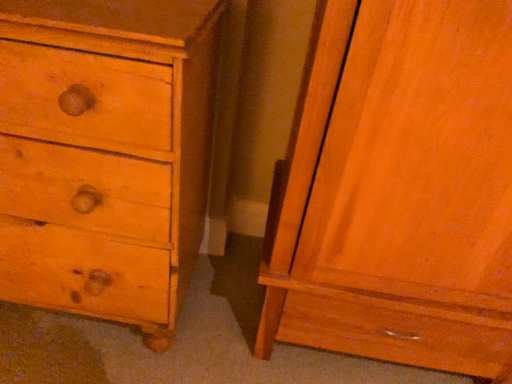
Describe the element at coordinates (399, 190) in the screenshot. I see `matte wood cabinet at right` at that location.

Identify the location of matte wood cabinet at right. This screenshot has height=384, width=512. (399, 190).

What is the approximate width of matte pine chest of drawers at left?

matte pine chest of drawers at left is 20.40 inches in width.

Describe the element at coordinates (105, 154) in the screenshot. I see `matte pine chest of drawers at left` at that location.

Identify the location of matte pine chest of drawers at left. (105, 154).

At what (x,y) coordinates should I click in order to perform the action: click on matte wood cabinet at right. Please return your answer as a coordinate pair (x, y). Looking at the image, I should click on (399, 190).

Looking at this image, does matte pine chest of drawers at left appear on the right side of matte wood cabinet at right?

No.

Does matte pine chest of drawers at left come in front of matte wood cabinet at right?

No, matte pine chest of drawers at left is further to the viewer.

Considering the positions of point (108, 145) and point (467, 100), is point (108, 145) closer or farther from the camera than point (467, 100)?

Clearly, point (108, 145) is more distant from the camera than point (467, 100).

From the image's perspective, would you say matte pine chest of drawers at left is shown under matte wood cabinet at right?

No, from the image's perspective, matte pine chest of drawers at left is not beneath matte wood cabinet at right.

From a real-world perspective, relative to matte wood cabinet at right, is matte pine chest of drawers at left vertically above or below?

Clearly, from a real-world perspective, matte pine chest of drawers at left is below matte wood cabinet at right.

Is matte pine chest of drawers at left wider than matte wood cabinet at right?

No, matte pine chest of drawers at left is not wider than matte wood cabinet at right.

From their relative heights in the image, would you say matte pine chest of drawers at left is taller or shorter than matte wood cabinet at right?

matte pine chest of drawers at left is shorter than matte wood cabinet at right.

Is matte pine chest of drawers at left smaller than matte wood cabinet at right?

Indeed, matte pine chest of drawers at left has a smaller size compared to matte wood cabinet at right.

Is matte pine chest of drawers at left outside of matte wood cabinet at right?

Yes.

Would you say matte pine chest of drawers at left is a long distance from matte wood cabinet at right?

No, matte pine chest of drawers at left is in close proximity to matte wood cabinet at right.

Is matte pine chest of drawers at left aimed at matte wood cabinet at right?

No, matte pine chest of drawers at left does not turn towards matte wood cabinet at right.

Can you tell me how much matte pine chest of drawers at left and matte wood cabinet at right differ in facing direction?

0.262 degrees.

How distant is matte pine chest of drawers at left from matte wood cabinet at right?

They are 16.63 inches apart.

Identify the location of the chest of drawers behind the matte wood cabinet at right. This screenshot has height=384, width=512. (105, 154).

Can you confirm if matte wood cabinet at right is positioned to the right of matte pine chest of drawers at left?

Yes.

Looking at this image, considering their positions, is matte wood cabinet at right located in front of or behind matte pine chest of drawers at left?

In the image, matte wood cabinet at right appears in front of matte pine chest of drawers at left.

Between point (452, 60) and point (37, 135), which one is positioned behind?

The point (37, 135) is more distant.

From the image's perspective, is matte wood cabinet at right below matte pine chest of drawers at left?

Yes.

From the picture: From a real-world perspective, which object stands above the other?

matte wood cabinet at right is physically above.

From the picture: Between matte wood cabinet at right and matte pine chest of drawers at left, which one has larger width?

With larger width is matte wood cabinet at right.

Is matte wood cabinet at right taller or shorter than matte pine chest of drawers at left?

Considering their sizes, matte wood cabinet at right has more height than matte pine chest of drawers at left.

Does matte wood cabinet at right have a larger size compared to matte pine chest of drawers at left?

Yes.

Is matte wood cabinet at right completely or partially outside of matte pine chest of drawers at left?

matte wood cabinet at right lies outside matte pine chest of drawers at left's area.

Is there a large distance between matte wood cabinet at right and matte pine chest of drawers at left?

Actually, matte wood cabinet at right and matte pine chest of drawers at left are a little close together.

Is matte pine chest of drawers at left at the back of matte wood cabinet at right?

No, matte wood cabinet at right is not facing the opposite direction of matte pine chest of drawers at left.

Can you tell me how much matte wood cabinet at right and matte pine chest of drawers at left differ in facing direction?

They differ by 0.262 degrees in their facing directions.

Locate an element on the screen. This screenshot has width=512, height=384. chest of drawers below the matte wood cabinet at right (from a real-world perspective) is located at coordinates (105, 154).

Identify the location of nightstand above the matte pine chest of drawers at left (from a real-world perspective). The width and height of the screenshot is (512, 384). (399, 190).

Locate an element on the screen. This screenshot has height=384, width=512. nightstand in front of the matte pine chest of drawers at left is located at coordinates (399, 190).